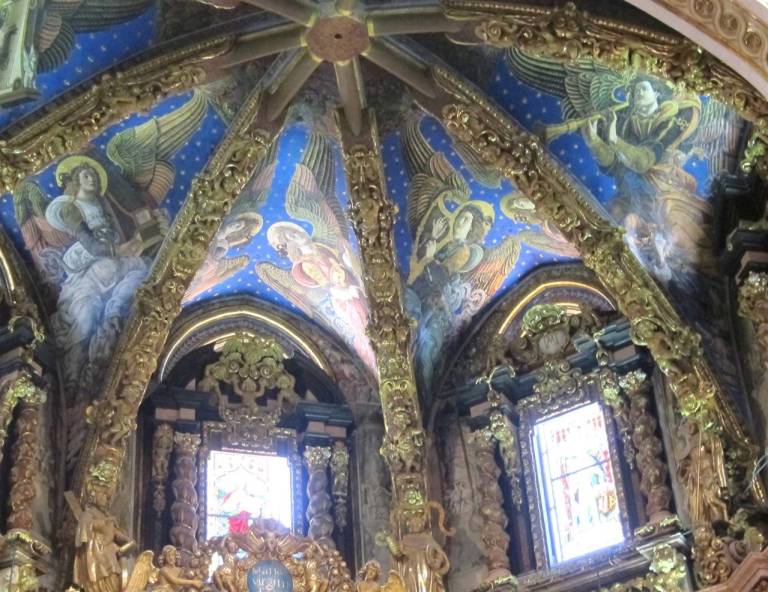
The width and height of the screenshot is (768, 592). In order to click on window in this screenshot , I will do `click(598, 520)`.